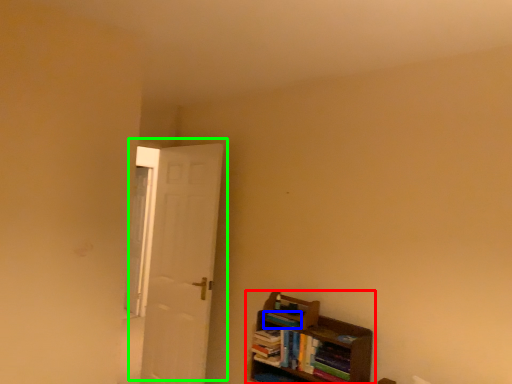
Question: Considering the real-world distances, which object is farthest from shelf (highlighted by a red box)? book (highlighted by a blue box) or door (highlighted by a green box)?

Choices:
 (A) book
 (B) door

Answer: (B)